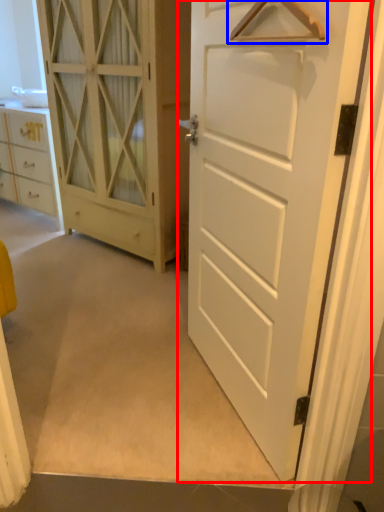
Question: Which of the following is the closest to the observer, door (highlighted by a red box) or hanger (highlighted by a blue box)?

Choices:
 (A) door
 (B) hanger

Answer: (B)